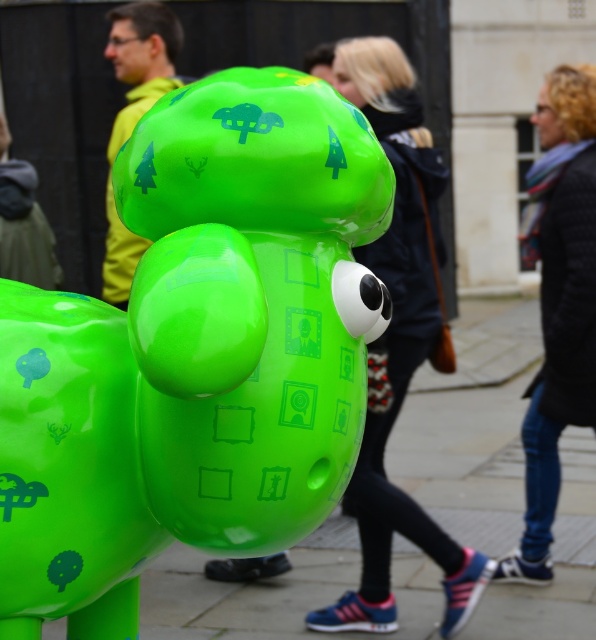
Is glossy green balloon at center positioned at the back of matte yellow jacket at upper left?

Answer: No.

Does glossy green balloon at center appear under matte yellow jacket at upper left?

Indeed, glossy green balloon at center is positioned under matte yellow jacket at upper left.

The width and height of the screenshot is (596, 640). What do you see at coordinates (69, 468) in the screenshot?
I see `glossy green balloon at center` at bounding box center [69, 468].

Find the location of a particular element. The image size is (596, 640). glossy green balloon at center is located at coordinates (69, 468).

Is glossy plastic toy at center bigger than black textured coat at right?

Actually, glossy plastic toy at center might be smaller than black textured coat at right.

Is point (48, 525) farther from viewer compared to point (558, 324)?

That is False.

This screenshot has height=640, width=596. Identify the location of glossy plastic toy at center. (194, 353).

Between glossy plastic toy at center and matte green sculpture at center, which one has more height?

Standing taller between the two is matte green sculpture at center.

The height and width of the screenshot is (640, 596). What do you see at coordinates (194, 353) in the screenshot?
I see `glossy plastic toy at center` at bounding box center [194, 353].

I want to click on glossy plastic toy at center, so click(x=194, y=353).